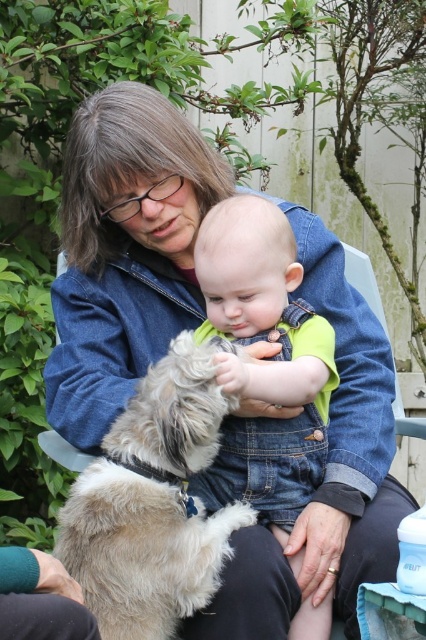
Can you confirm if fuzzy beige dog at center is positioned to the left of denim overalls at center?

Yes, fuzzy beige dog at center is to the left of denim overalls at center.

Who is positioned more to the right, fuzzy beige dog at center or denim overalls at center?

denim overalls at center is more to the right.

Locate an element on the screen. The image size is (426, 640). fuzzy beige dog at center is located at coordinates (152, 502).